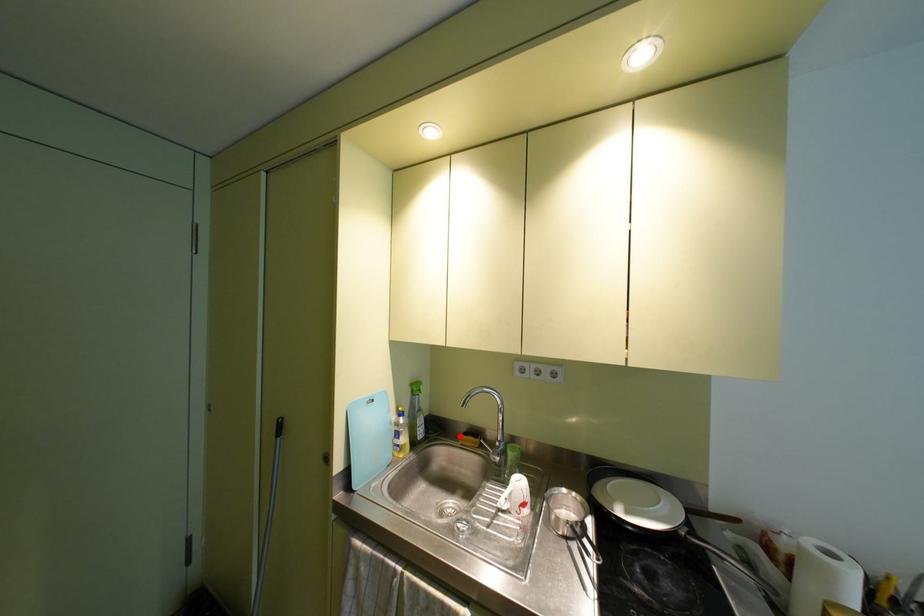
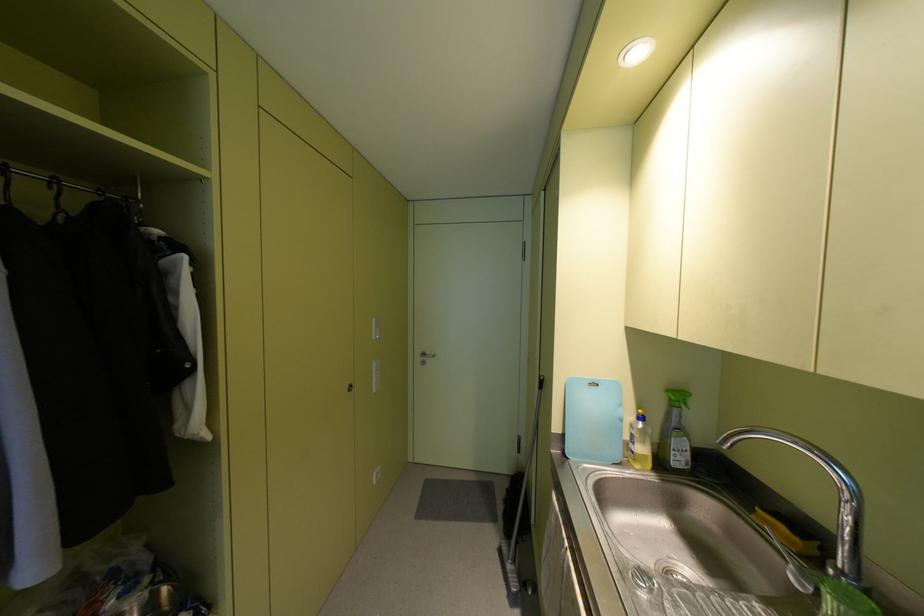
Where in the second image is the point corresponding to the highlighted location from the first image?

(759, 511)